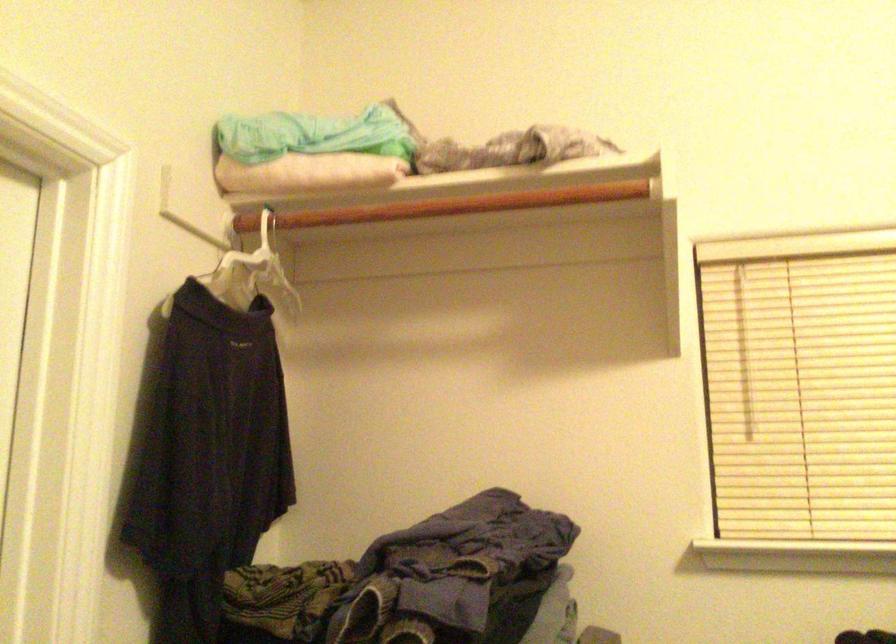
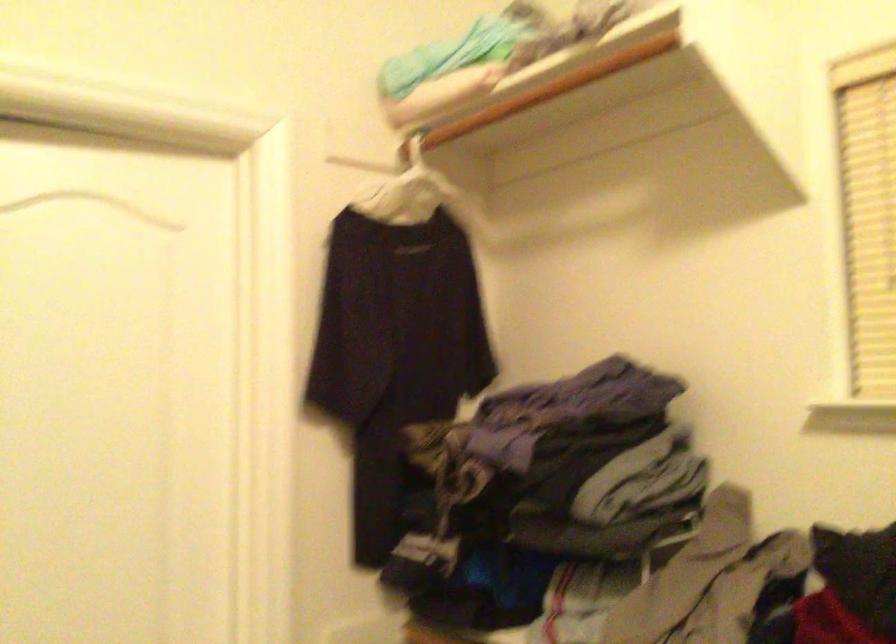
Question: The camera is either moving clockwise (left) or counter-clockwise (right) around the object. The first image is from the beginning of the video and the second image is from the end. Is the camera moving left or right when shooting the video?

Choices:
 (A) Left
 (B) Right

Answer: (B)